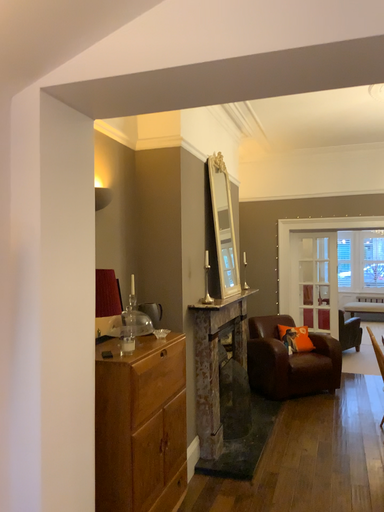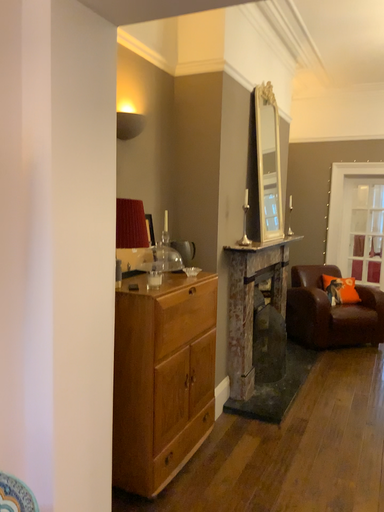
Question: Which way did the camera rotate in the video?

Choices:
 (A) rotated upward
 (B) rotated downward

Answer: (B)